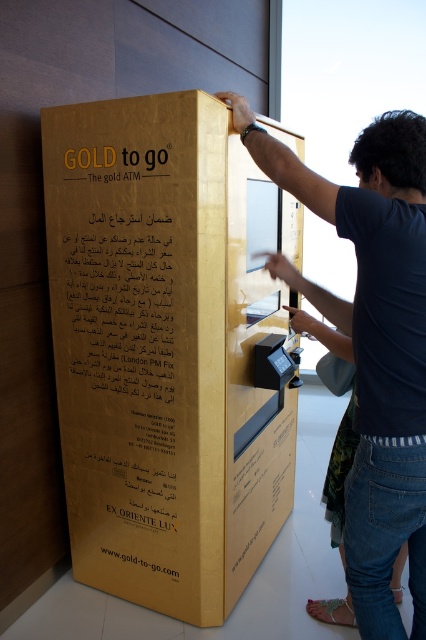
Question: Among these points, which one is farthest from the camera?

Choices:
 (A) (210, 312)
 (B) (271, 266)

Answer: (B)

Question: Does gold metallic atm at center have a larger size compared to dark blue shirt at center?

Choices:
 (A) yes
 (B) no

Answer: (A)

Question: Is gold metallic atm at center wider than dark blue shirt at center?

Choices:
 (A) no
 (B) yes

Answer: (B)

Question: Which point is closer to the camera?

Choices:
 (A) (144, 221)
 (B) (422, 156)

Answer: (B)

Question: Is the position of gold metallic atm at center more distant than that of dark blue shirt at center?

Choices:
 (A) yes
 (B) no

Answer: (A)